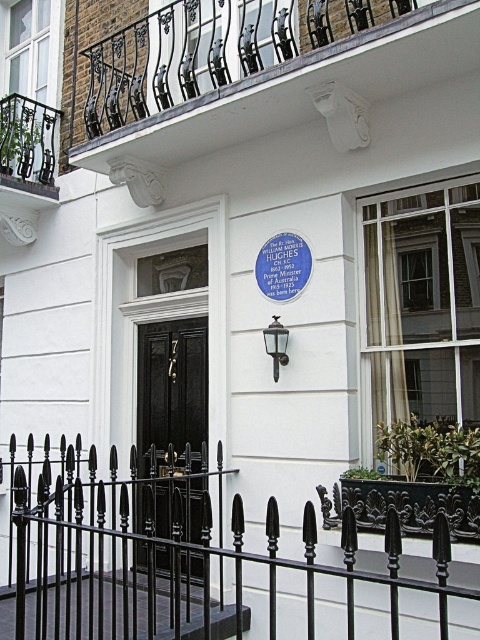
You are standing at the entrance of the building and want to locate the plaque commemorating William Morris Hughes. There are two points marked on the wall to the right of the entrance. Which point is closer to you, point (184, 582) or point (162, 566)?

Point (184, 582) is in front of point (162, 566), so the point closer to you is point (184, 582).